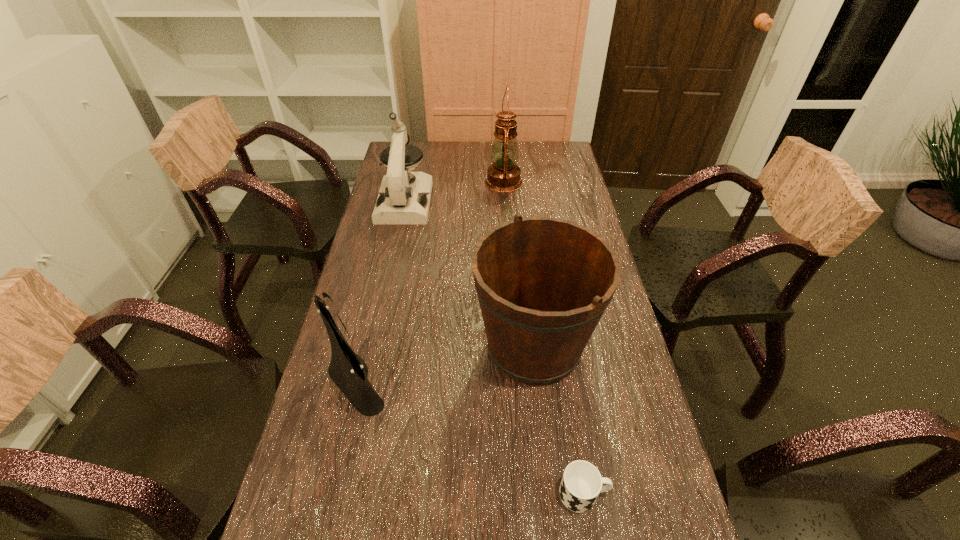
You are a GUI agent. You are given a task and a screenshot of the screen. Output one action in this format:
    pyautogui.click(x=<x>, y=<y>)
    Task: Click on the vacant area located 0.090m on the side of the nearest object with the handle
    The width and height of the screenshot is (960, 540).
    Given the screenshot: What is the action you would take?
    pyautogui.click(x=652, y=494)

Where is `microscope that is positioned at the left edge`? microscope that is positioned at the left edge is located at coordinates (404, 197).

The image size is (960, 540). Identify the location of shoulder bag at the left edge. (361, 394).

This screenshot has height=540, width=960. I want to click on bucket situated at the right edge, so click(x=543, y=284).

Find the location of a particular element. cup that is at the right edge is located at coordinates (581, 483).

You are a GUI agent. You are given a task and a screenshot of the screen. Output one action in this format:
    pyautogui.click(x=<x>, y=<y>)
    Task: Click on the free location at the far edge
    This screenshot has width=960, height=540.
    Given the screenshot: What is the action you would take?
    pyautogui.click(x=428, y=152)

In the image, there is a desktop. Where is `vacant space at the left edge`? vacant space at the left edge is located at coordinates (334, 472).

In the image, there is a desktop. Where is `vacant region at the right edge`? Image resolution: width=960 pixels, height=540 pixels. vacant region at the right edge is located at coordinates (644, 470).

Identify the location of vacant space at the far right corner of the desktop. This screenshot has height=540, width=960. (540, 158).

I want to click on free space between the bucket and the shoulder bag, so click(444, 366).